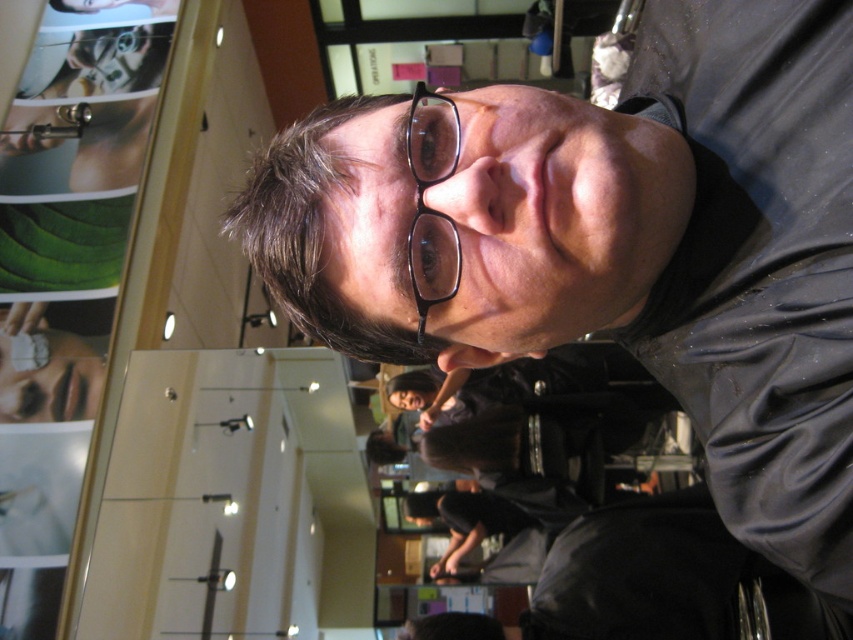
You are a salesperson in an eyewear store. You have two pairs of glasses displayed in the showcase. The matte black glasses at upper center and the black plastic glasses at center. A customer asks which pair is larger. How do you respond?

The matte black glasses at upper center is bigger than the black plastic glasses at center, so the matte black glasses at upper center is the larger pair.

You are a customer at an eyewear store and see two pairs of glasses displayed in the image. The matte black glasses at upper center and the black plastic glasses at center. Which pair has a wider frame?

The matte black glasses at upper center might be wider than black plastic glasses at center.

Consider the image. You are at an exhibition and see two pairs of glasses displayed. The first is the matte black glasses at upper center and the second is the black plastic glasses at center. Which pair is positioned higher in the display?

The matte black glasses at upper center is positioned higher than the black plastic glasses at center.